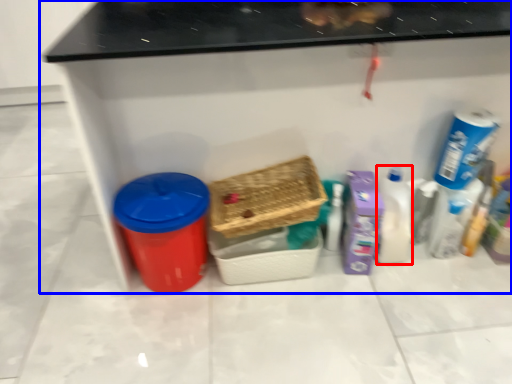
Question: Which object is closer to the camera taking this photo, cleaning product (highlighted by a red box) or furniture (highlighted by a blue box)?

Choices:
 (A) cleaning product
 (B) furniture

Answer: (B)